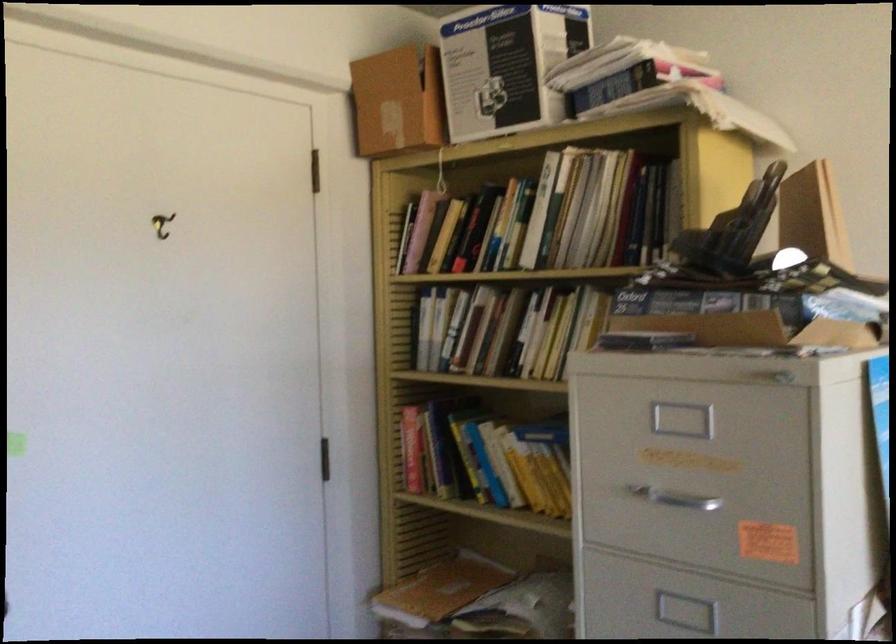
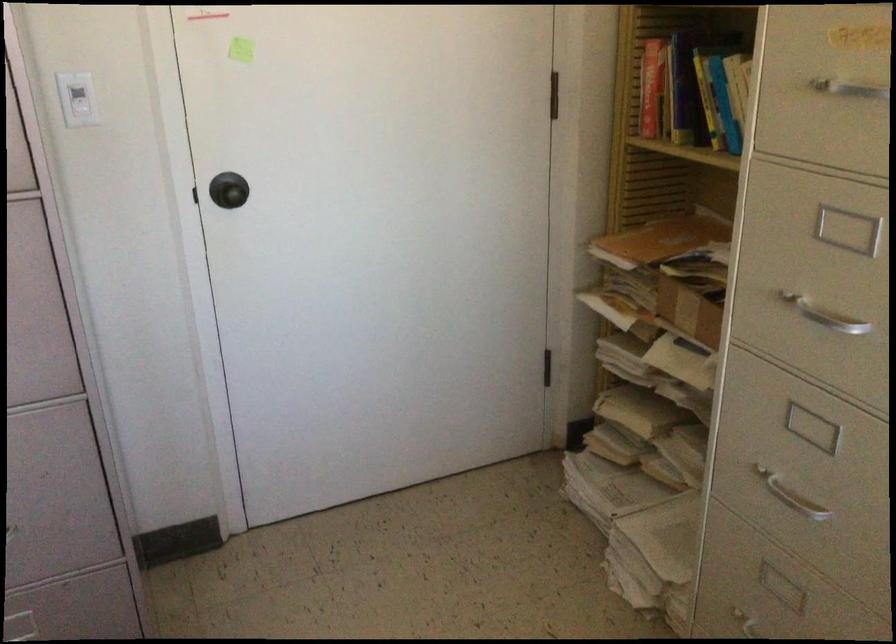
How did the camera likely rotate?

The camera rotated toward left-down.